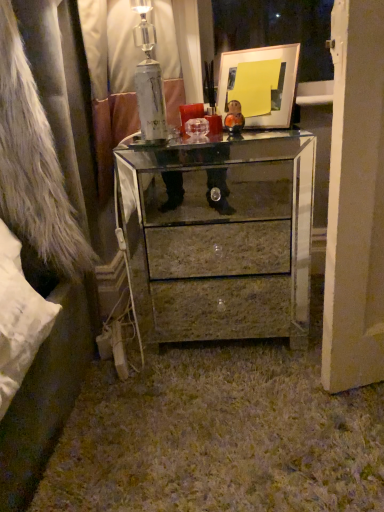
Where is `vacant space in front of mirrored glass chest of drawers at center`? The image size is (384, 512). vacant space in front of mirrored glass chest of drawers at center is located at coordinates (226, 414).